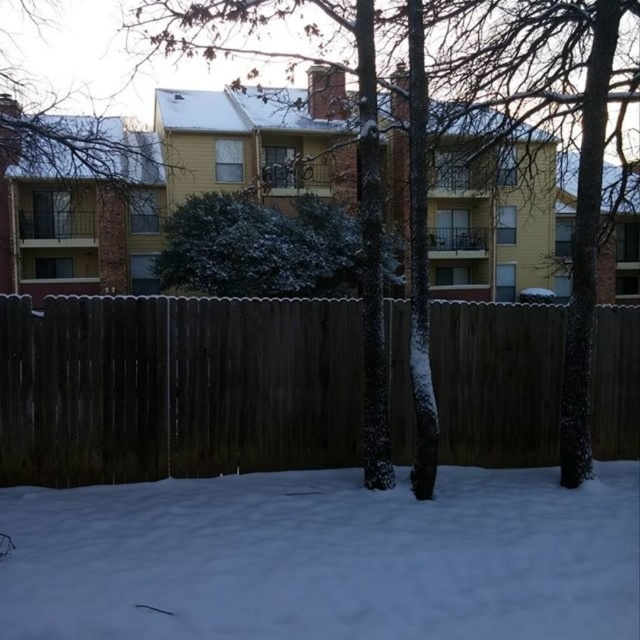
Question: Which of the following is the farthest from the observer?

Choices:
 (A) white fluffy snow at lower center
 (B) dark brown wood fence at center
 (C) green textured bush at center
 (D) smooth bark tree at upper center

Answer: (C)

Question: Estimate the real-world distances between objects in this image. Which object is closer to the smooth bark tree at upper center?

Choices:
 (A) green textured bush at center
 (B) white fluffy snow at lower center

Answer: (A)

Question: From the image, what is the correct spatial relationship of white fluffy snow at lower center in relation to smooth bark tree at upper center?

Choices:
 (A) below
 (B) above

Answer: (A)

Question: Does white fluffy snow at lower center appear over dark brown wood fence at center?

Choices:
 (A) no
 (B) yes

Answer: (A)

Question: Based on their relative distances, which object is farther from the dark brown wood fence at center?

Choices:
 (A) smooth bark tree at upper center
 (B) green textured bush at center

Answer: (A)

Question: Does dark brown wood fence at center appear on the left side of smooth bark tree at upper center?

Choices:
 (A) no
 (B) yes

Answer: (A)